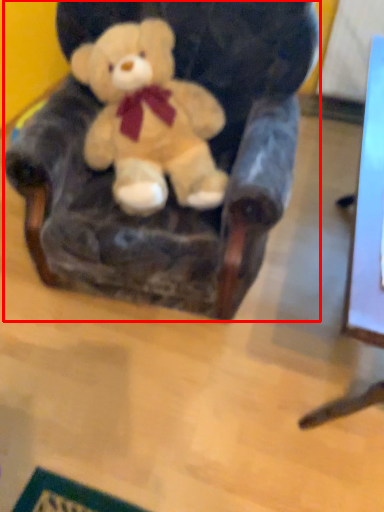
Question: In this image, where is armchair (annotated by the red box) located relative to teddy bear?

Choices:
 (A) right
 (B) left

Answer: (A)